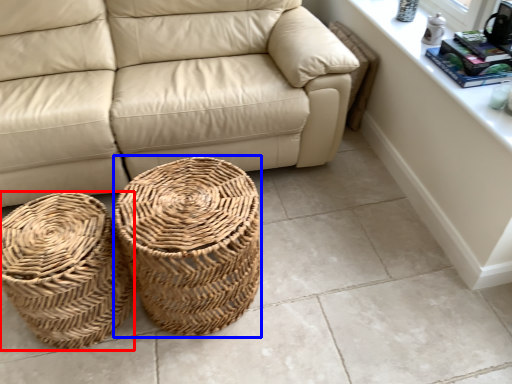
Question: Which object appears farthest to the camera in this image, basket (highlighted by a red box) or basket (highlighted by a blue box)?

Choices:
 (A) basket
 (B) basket

Answer: (A)